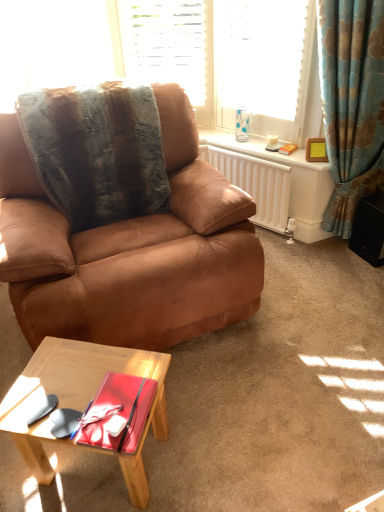
In order to click on vacant space to the right of brown leather chair at center in this screenshot , I will do `click(315, 313)`.